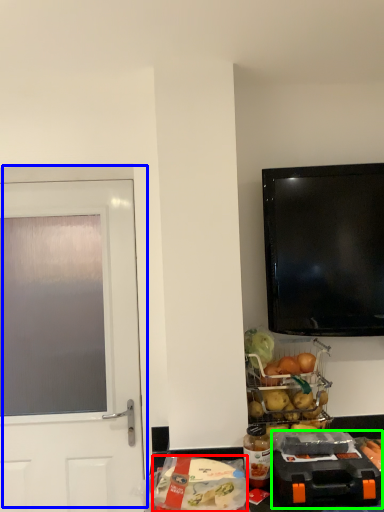
Question: Based on their relative distances, which object is farther from food (highlighted by a red box)? Choose from door (highlighted by a blue box) and appliance (highlighted by a green box).

Choices:
 (A) door
 (B) appliance

Answer: (A)